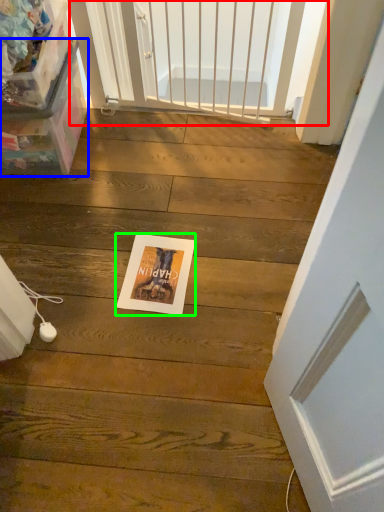
Question: Which is farther away from screen door (highlighted by a red box)? box (highlighted by a blue box) or postcard (highlighted by a green box)?

Choices:
 (A) box
 (B) postcard

Answer: (B)